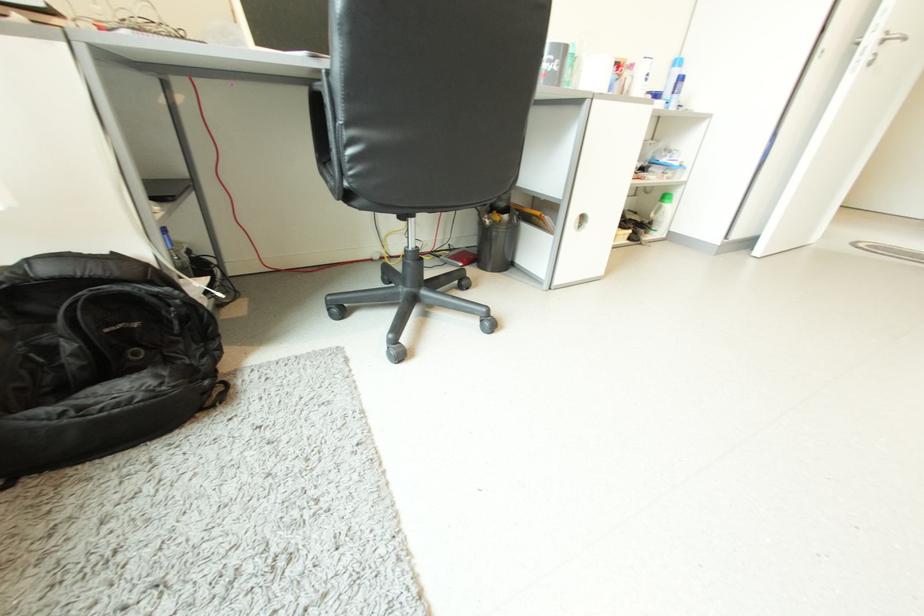
Where is `blue aerosol can`? The height and width of the screenshot is (616, 924). blue aerosol can is located at coordinates (673, 76).